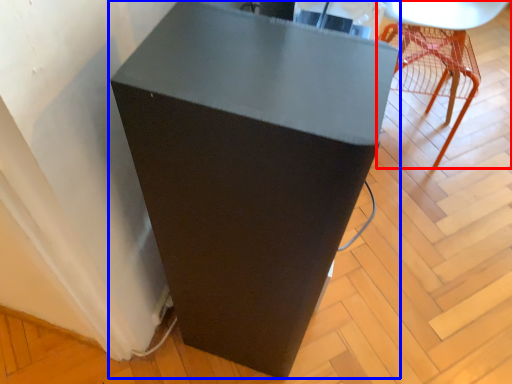
Question: Which object is further to the camera taking this photo, furniture (highlighted by a red box) or furniture (highlighted by a blue box)?

Choices:
 (A) furniture
 (B) furniture

Answer: (A)